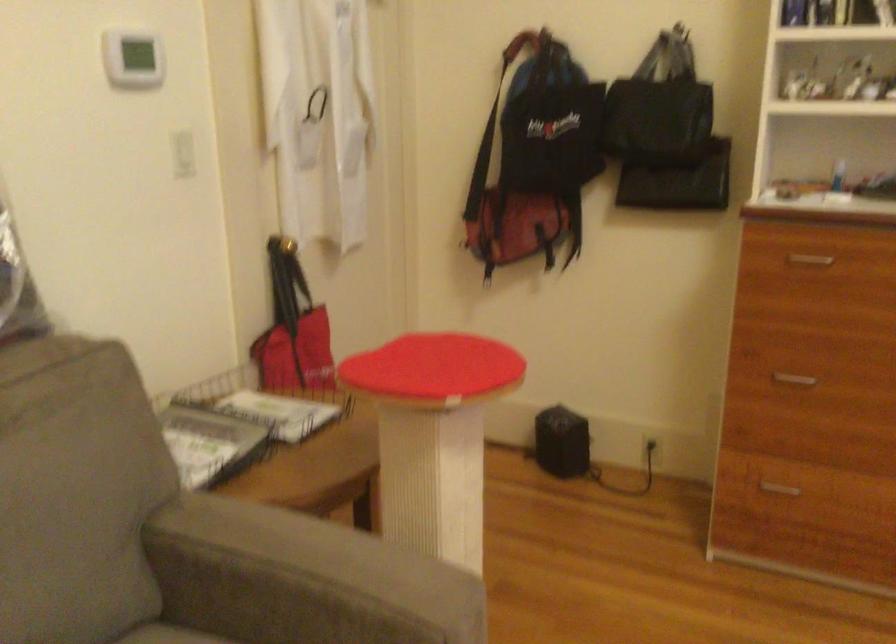
The height and width of the screenshot is (644, 896). Describe the element at coordinates (286, 281) in the screenshot. I see `the red bag handle` at that location.